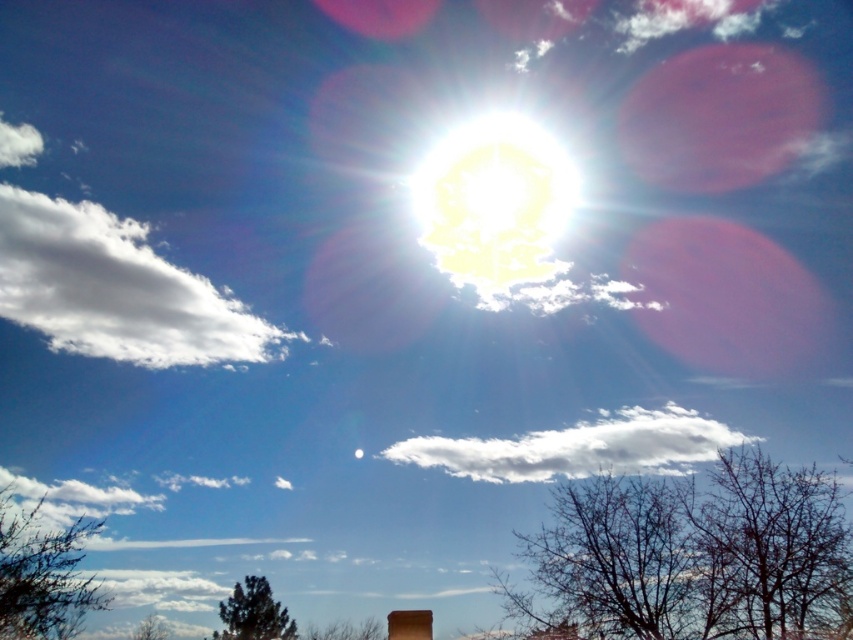
Is white fluffy cloud at upper left positioned in front of brown matte chimney at lower center?

That is False.

Can you confirm if white fluffy cloud at upper left is positioned to the right of brown matte chimney at lower center?

No, white fluffy cloud at upper left is not to the right of brown matte chimney at lower center.

Between point (22, 289) and point (399, 636), which one is positioned in front?

Point (399, 636) is in front.

Image resolution: width=853 pixels, height=640 pixels. What are the coordinates of `white fluffy cloud at upper left` in the screenshot? It's located at (115, 289).

Does white bright at center have a greater width compared to brown matte chimney at lower center?

Indeed, white bright at center has a greater width compared to brown matte chimney at lower center.

Can you confirm if white bright at center is positioned to the right of brown matte chimney at lower center?

Correct, you'll find white bright at center to the right of brown matte chimney at lower center.

The image size is (853, 640). Describe the element at coordinates (494, 202) in the screenshot. I see `white bright at center` at that location.

The height and width of the screenshot is (640, 853). Find the location of `white bright at center`. white bright at center is located at coordinates (494, 202).

Can you confirm if white bright at center is positioned to the left of green matte tree at lower left?

No, white bright at center is not to the left of green matte tree at lower left.

Is white bright at center thinner than green matte tree at lower left?

No.

Identify the location of white bright at center. Image resolution: width=853 pixels, height=640 pixels. (494, 202).